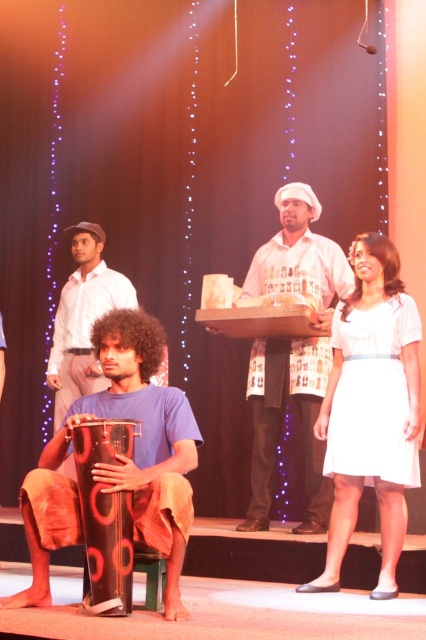
You are an audience member sitting in the front row. You notice the black matte drum at lower left and the white printed shirt at center. Which object is closer to your left side?

The black matte drum at lower left is closer to your left side since it is positioned to the left of the white printed shirt at center.

You are a stagehand preparing to move the black matte drum at lower left and the white printed shirt at center. Based on their positions, which object is closer to the front of the stage?

The black matte drum at lower left is closer to the front of the stage than the white printed shirt at center.

You are an audience member sitting in the front row. You notice two items on stage, the black matte drum at lower left and the white printed shirt at center. Which one is positioned lower in the stage setup?

The black matte drum at lower left is located below the white printed shirt at center, so it is positioned lower in the stage setup.